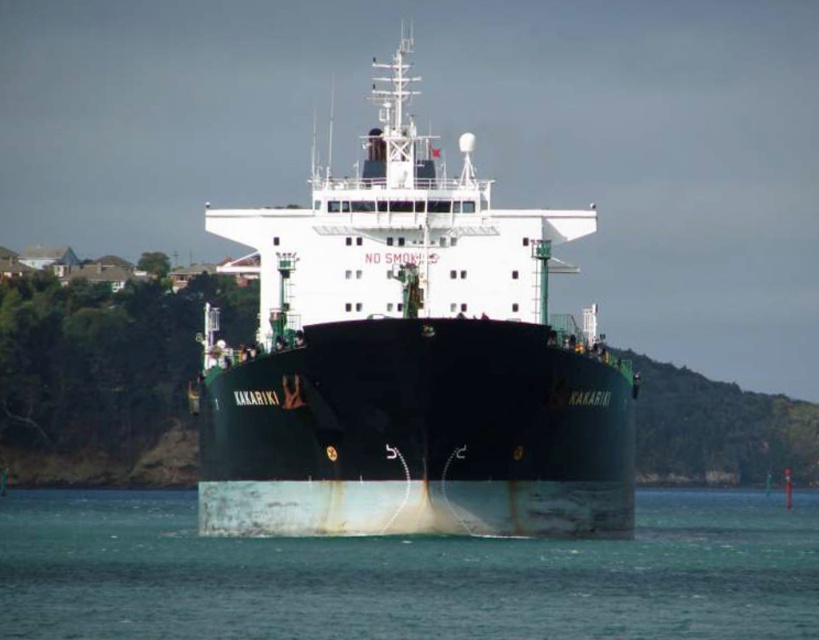
Question: From the image, what is the correct spatial relationship of green matte ship at center in relation to white matte water at center?

Choices:
 (A) above
 (B) below

Answer: (A)

Question: Does green matte ship at center appear over white matte water at center?

Choices:
 (A) no
 (B) yes

Answer: (B)

Question: Is green matte ship at center below white matte water at center?

Choices:
 (A) yes
 (B) no

Answer: (B)

Question: Among these objects, which one is nearest to the camera?

Choices:
 (A) green matte ship at center
 (B) white matte water at center

Answer: (B)

Question: Which point is closer to the camera?

Choices:
 (A) white matte water at center
 (B) green matte ship at center

Answer: (A)